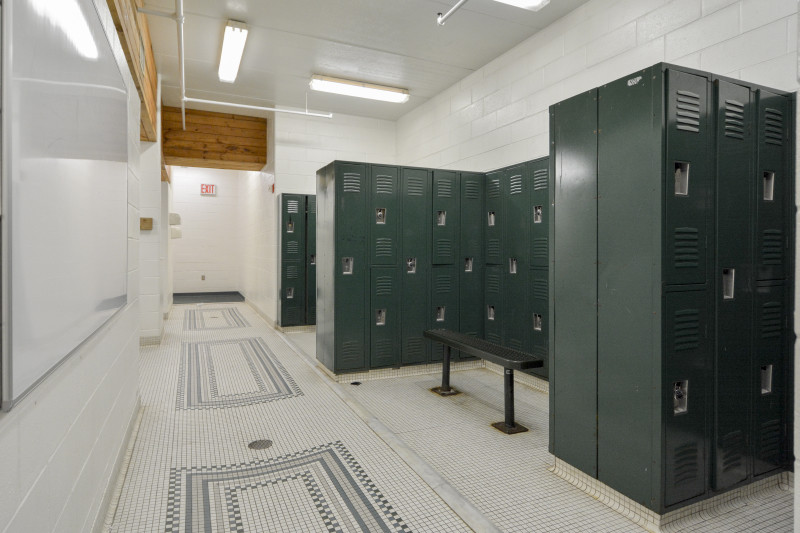
You are a GUI agent. You are given a task and a screenshot of the screen. Output one action in this format:
    pyautogui.click(x=<x>, y=<y>)
    Task: Click on the green lockers
    The width and height of the screenshot is (800, 533).
    Given the screenshot: What is the action you would take?
    pyautogui.click(x=598, y=221), pyautogui.click(x=374, y=240), pyautogui.click(x=306, y=224)